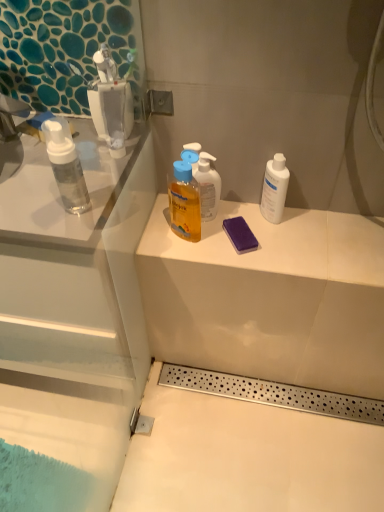
Image resolution: width=384 pixels, height=512 pixels. Identify the location of vacant space situated on the left part of translucent yellow liquid at upper center. (153, 236).